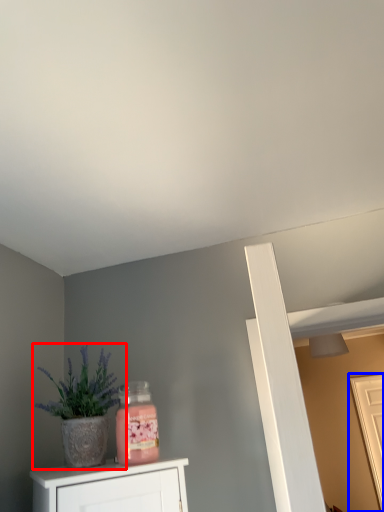
Question: Which of the following is the farthest to the observer, houseplant (highlighted by a red box) or door (highlighted by a blue box)?

Choices:
 (A) houseplant
 (B) door

Answer: (B)